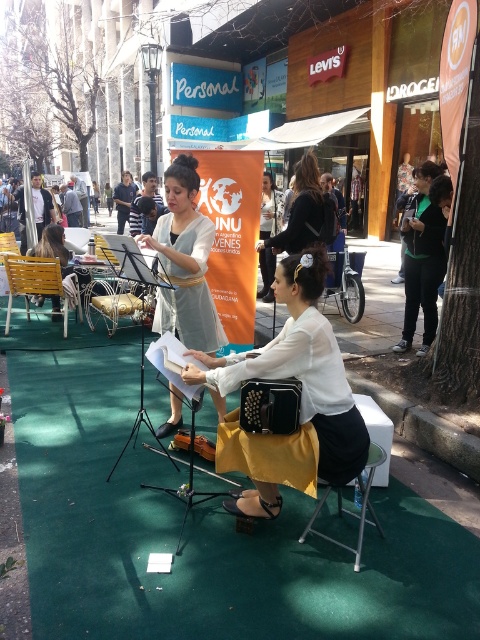
You are standing at the center of the image. Which direction should you look to see the yellow plastic chair at left?

The yellow plastic chair at left is located at the lower left side of the image, so you should look to your left to see it.